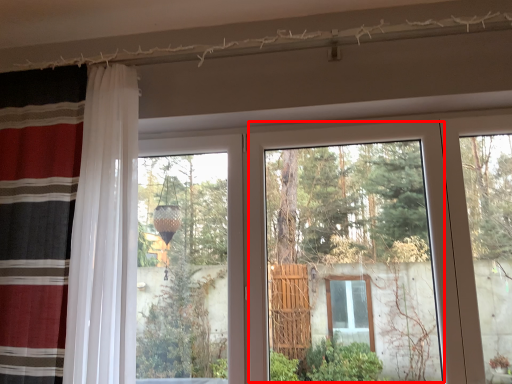
Question: Observing the image, what is the correct spatial positioning of glass door (annotated by the red box) in reference to curtain?

Choices:
 (A) left
 (B) right

Answer: (B)